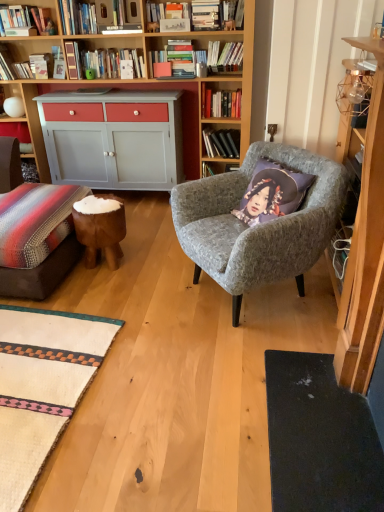
Where is `empty space that is ontop of matte gray cabinet at left, which is counted as the first shelf, starting from the back (from a real-world perspective)`? This screenshot has height=512, width=384. empty space that is ontop of matte gray cabinet at left, which is counted as the first shelf, starting from the back (from a real-world perspective) is located at coordinates (21, 119).